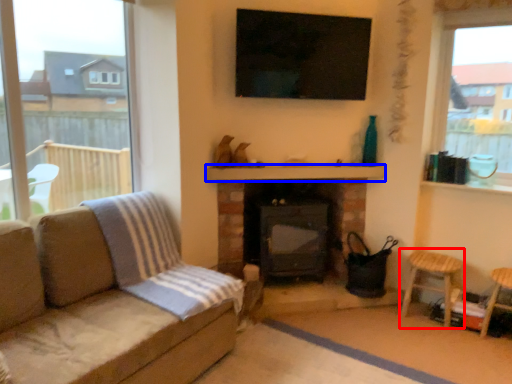
Question: Which object appears farthest to the camera in this image, bar stool (highlighted by a red box) or balustrade (highlighted by a blue box)?

Choices:
 (A) bar stool
 (B) balustrade

Answer: (B)